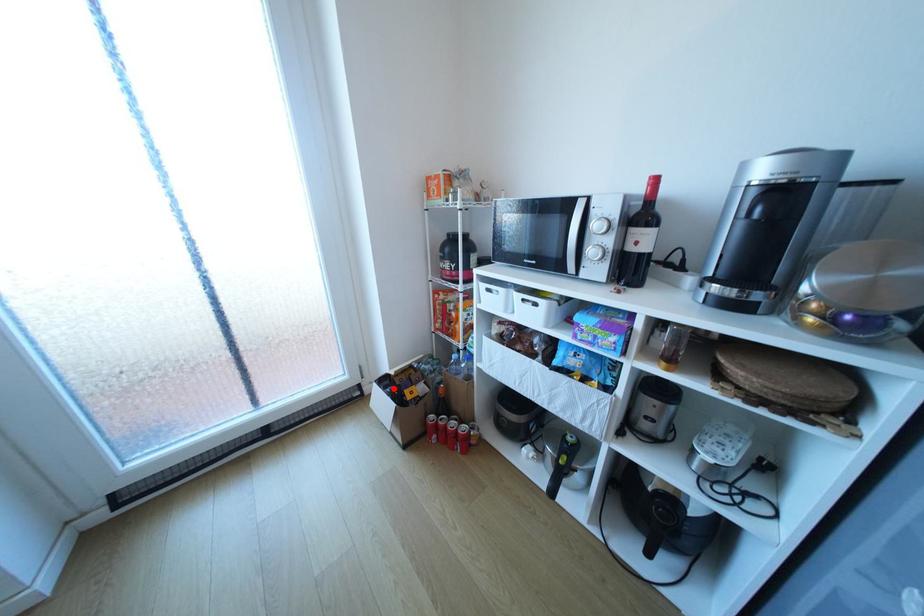
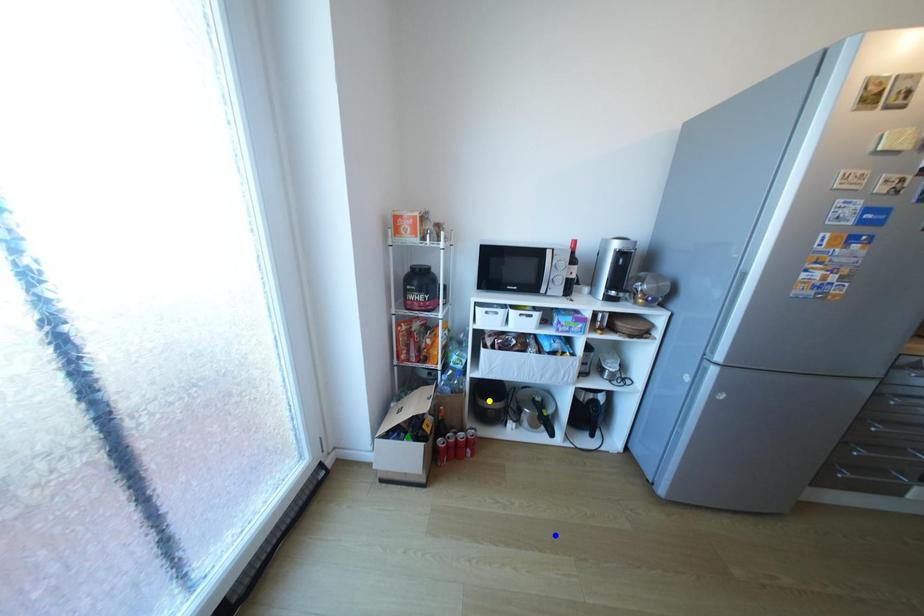
Question: I am providing you with two images of the same scene from different viewpoints. A red point is marked on the first image. You are given multiple points on the second image. In image 2, which mark is for the same physical point as the one in image 1?

Choices:
 (A) blue point
 (B) green point
 (C) yellow point

Answer: (B)